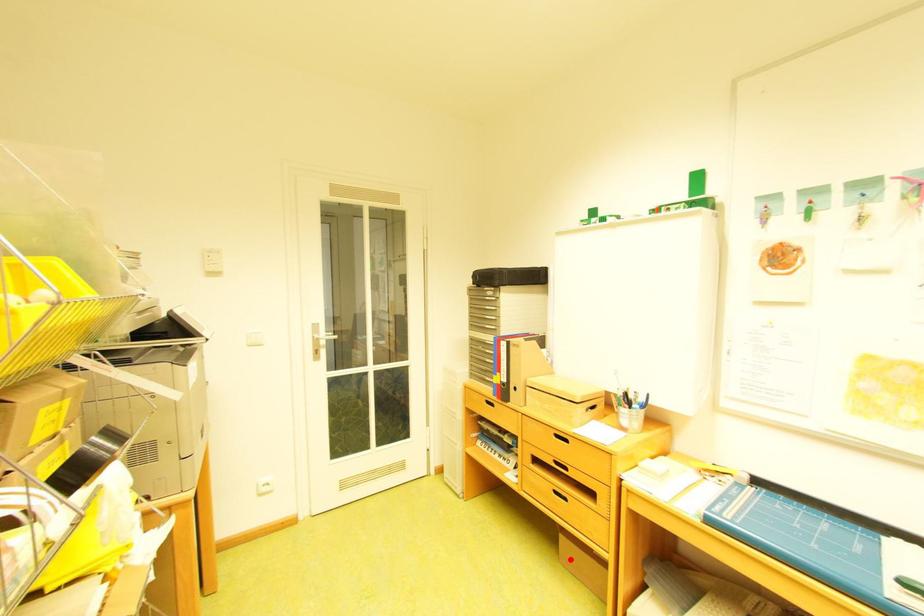
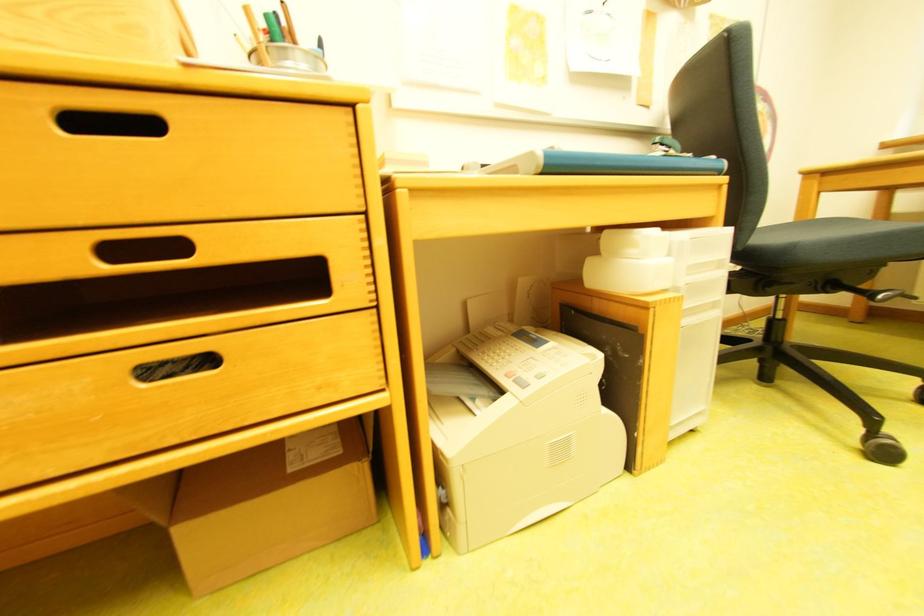
In the second image, find the point that corresponds to the highlighted location in the first image.

(201, 592)